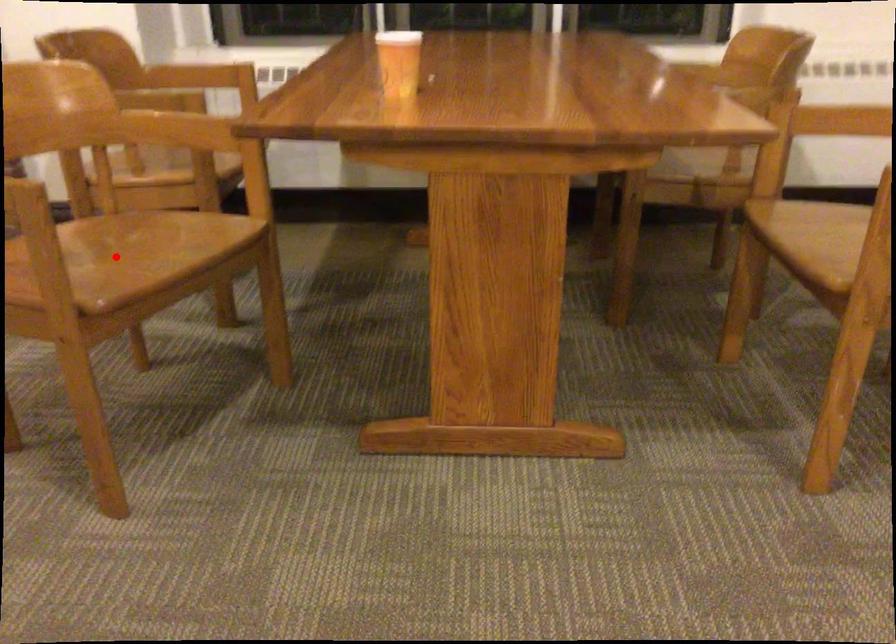
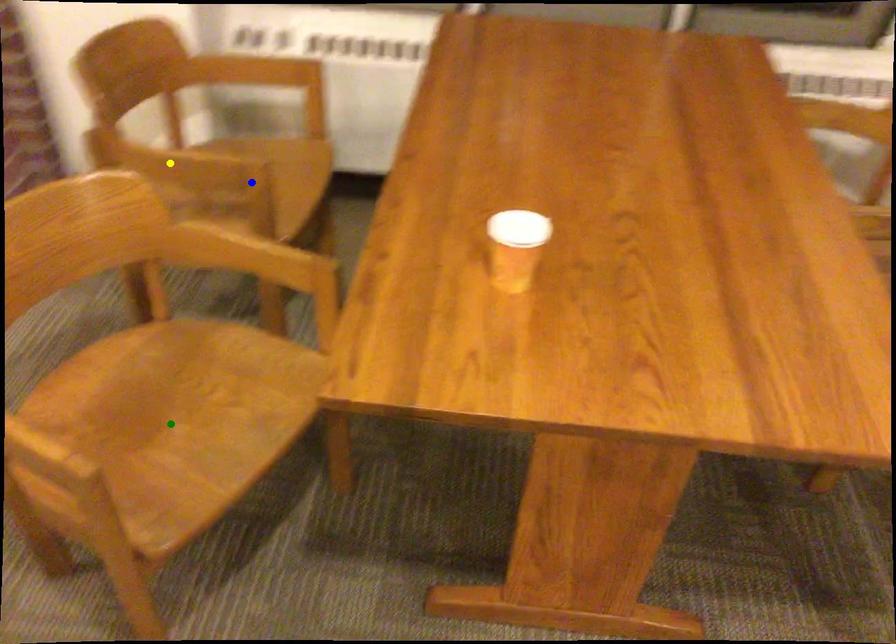
Question: I am providing you with two images of the same scene from different viewpoints. A red point is marked on the first image. You are given multiple points on the second image. Which spot in image 2 lines up with the point in image 1?

Choices:
 (A) green point
 (B) blue point
 (C) yellow point

Answer: (A)